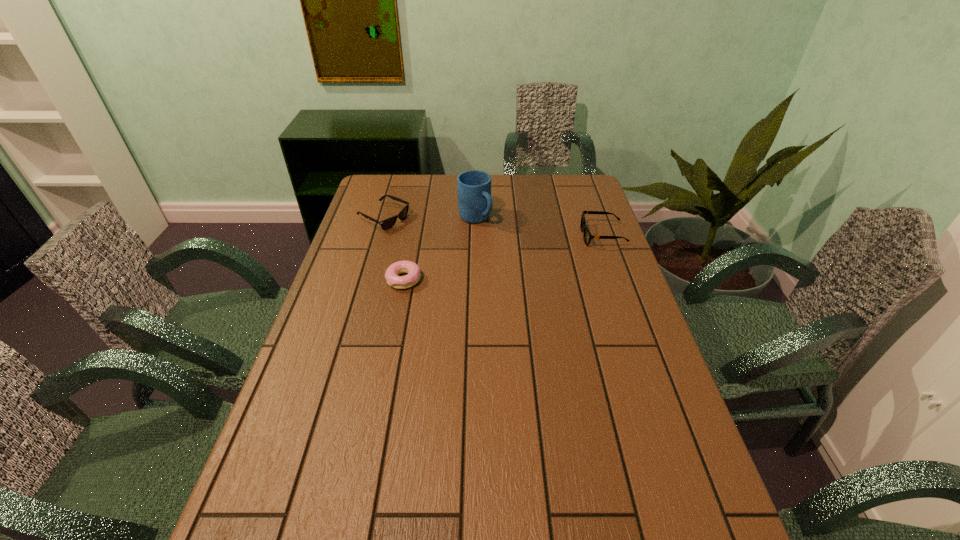
Locate an element on the screen. Image resolution: width=960 pixels, height=540 pixels. blank space located 0.140m on the side of the mug with the handle is located at coordinates (507, 249).

Find the location of a particular element. Image resolution: width=960 pixels, height=540 pixels. free space located 0.400m on the side of the mug with the handle is located at coordinates (557, 294).

Locate an element on the screen. vacant space positioned 0.350m on the side of the mug with the handle is located at coordinates (546, 284).

Locate an element on the screen. The height and width of the screenshot is (540, 960). free space located on the front-facing side of the left sunglasses is located at coordinates (429, 238).

Where is `vacant space located on the front-facing side of the left sunglasses`? The image size is (960, 540). vacant space located on the front-facing side of the left sunglasses is located at coordinates (439, 242).

The image size is (960, 540). I want to click on free space located on the front-facing side of the left sunglasses, so click(450, 247).

Locate an element on the screen. object located in the left edge section of the desktop is located at coordinates (386, 224).

The width and height of the screenshot is (960, 540). In order to click on object that is at the right edge in this screenshot , I will do `click(587, 236)`.

The image size is (960, 540). I want to click on free space at the far edge, so click(x=540, y=188).

Find the location of a particular element. This screenshot has width=960, height=540. vacant space at the near edge is located at coordinates (417, 492).